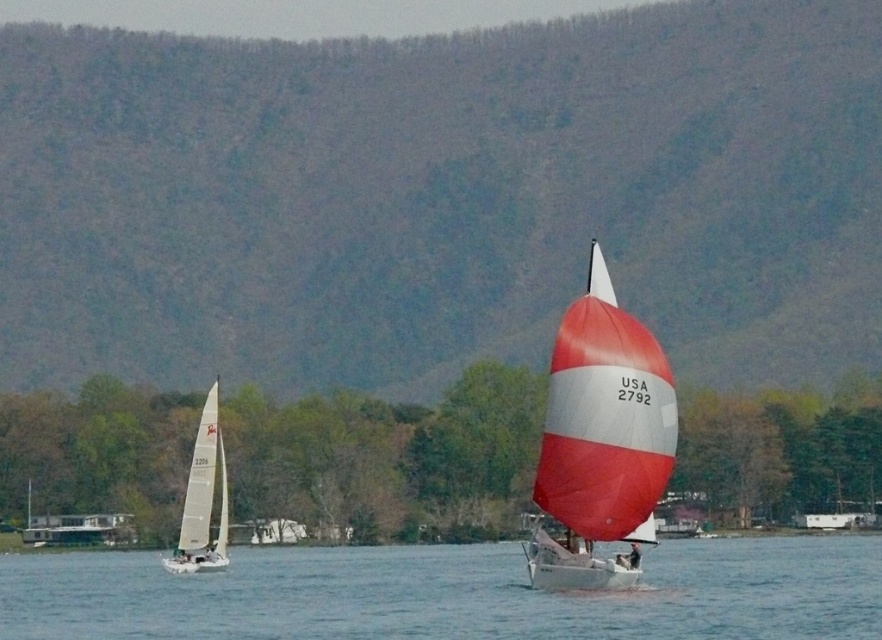
You are a sailor planning to dock your boat at the nearest pier. You see the red and white striped sailboat at center and the white matte sailboat at left. Which boat is closer to the pier based on their positions?

The red and white striped sailboat at center is located above the white matte sailboat at left, so it is closer to the pier.

You are a sailor planning to dock your boat at the clear blue water at center. You see the red and white striped sailboat at center nearby. Can you safely maneuver your boat between them without touching either?

The clear blue water at center might be wider than the red and white striped sailboat at center, so there might be enough space to safely maneuver between them, but you should proceed with caution as the width difference is uncertain.

You are standing on the dock and want to throw a lifebuoy to a swimmer in the clear blue water at center. The lifebuoy can travel 150 feet. Will it reach the swimmer?

The clear blue water at center is 162.54 feet away from viewer. The lifebuoy can travel 150 feet, so it will not reach the swimmer.